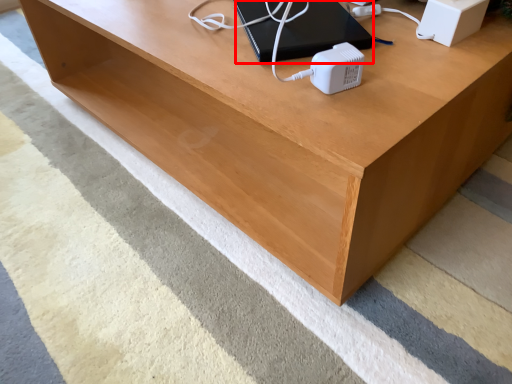
Question: From the image's perspective, what is the correct spatial relationship of computer (annotated by the red box) in relation to speaker?

Choices:
 (A) above
 (B) below

Answer: (A)